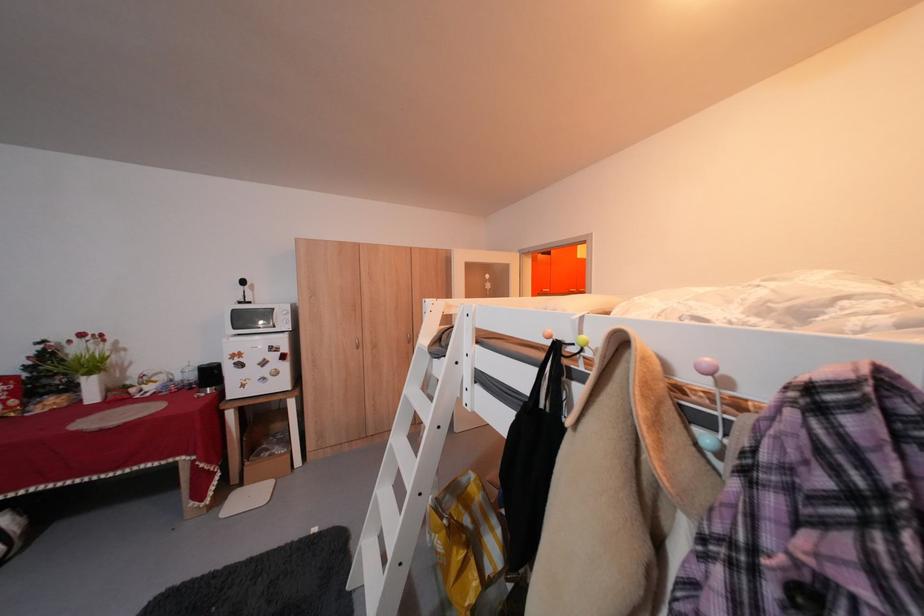
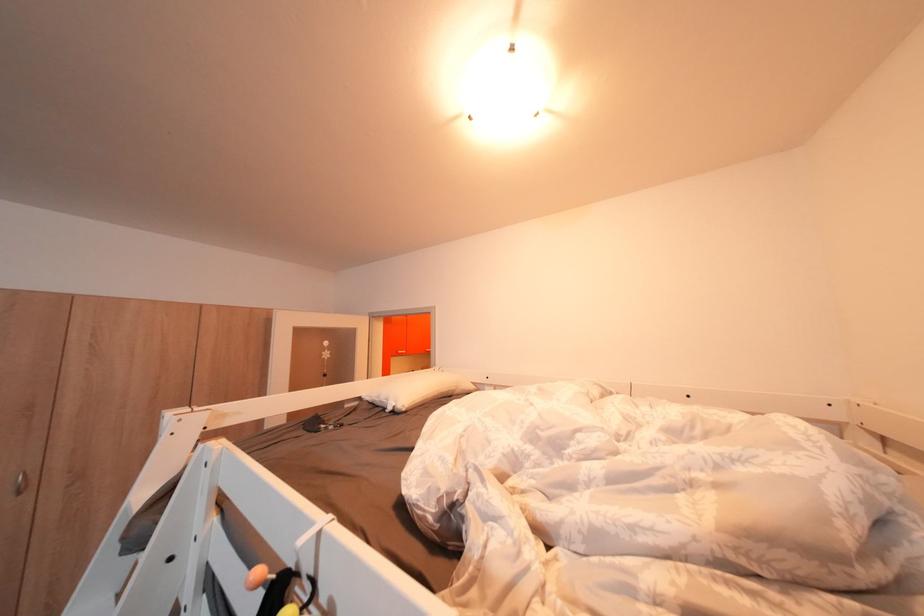
Question: The first image is from the beginning of the video and the second image is from the end. How did the camera likely rotate when shooting the video?

Choices:
 (A) Left
 (B) Right
 (C) Up
 (D) Down

Answer: (B)